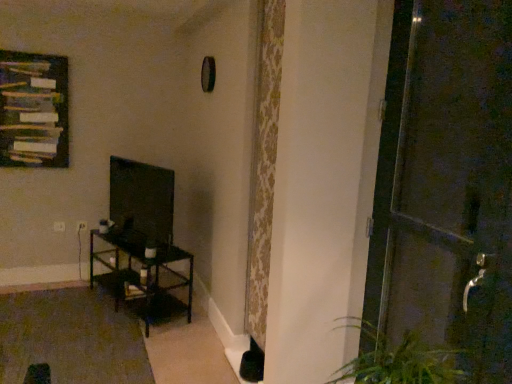
Question: Is matte black tv at left oriented towards wooden frame at upper left?

Choices:
 (A) no
 (B) yes

Answer: (A)

Question: Is matte black tv at left at the right side of wooden frame at upper left?

Choices:
 (A) yes
 (B) no

Answer: (A)

Question: Is matte black tv at left directly adjacent to wooden frame at upper left?

Choices:
 (A) yes
 (B) no

Answer: (B)

Question: From a real-world perspective, is matte black tv at left positioned under wooden frame at upper left based on gravity?

Choices:
 (A) no
 (B) yes

Answer: (B)

Question: Is matte black tv at left oriented away from wooden frame at upper left?

Choices:
 (A) no
 (B) yes

Answer: (A)

Question: From the image's perspective, is matte black tv at left on top of wooden frame at upper left?

Choices:
 (A) no
 (B) yes

Answer: (A)

Question: Considering the relative sizes of dark brown metal table at left and matte black tv at left in the image provided, is dark brown metal table at left smaller than matte black tv at left?

Choices:
 (A) no
 (B) yes

Answer: (A)

Question: Does dark brown metal table at left come in front of matte black tv at left?

Choices:
 (A) no
 (B) yes

Answer: (A)

Question: Does dark brown metal table at left lie behind matte black tv at left?

Choices:
 (A) yes
 (B) no

Answer: (A)

Question: Considering the relative sizes of dark brown metal table at left and matte black tv at left in the image provided, is dark brown metal table at left wider than matte black tv at left?

Choices:
 (A) no
 (B) yes

Answer: (B)

Question: Is dark brown metal table at left next to matte black tv at left?

Choices:
 (A) yes
 (B) no

Answer: (B)

Question: Does dark brown metal table at left have a larger size compared to matte black tv at left?

Choices:
 (A) no
 (B) yes

Answer: (B)

Question: Is the position of wooden frame at upper left more distant than that of metallic dark brown door at right?

Choices:
 (A) no
 (B) yes

Answer: (B)